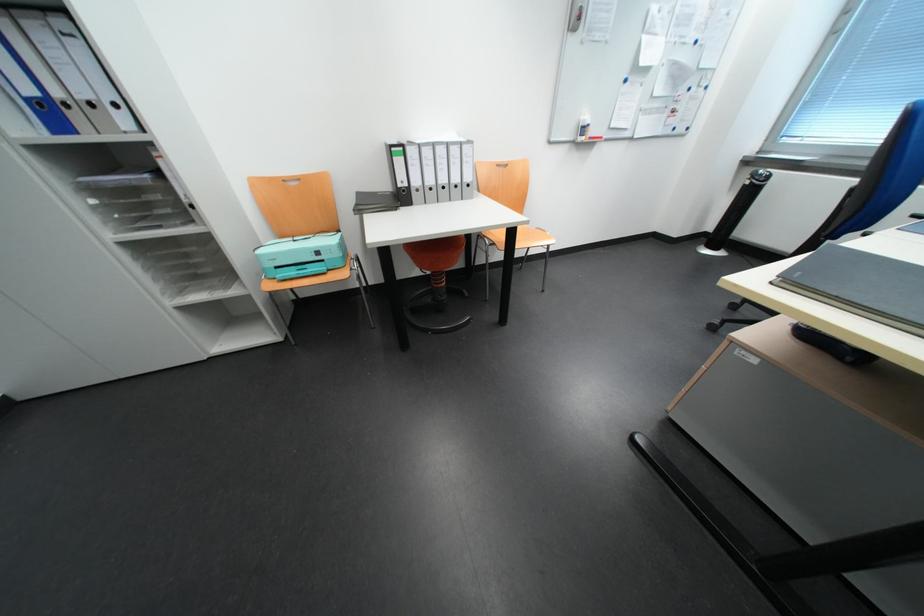
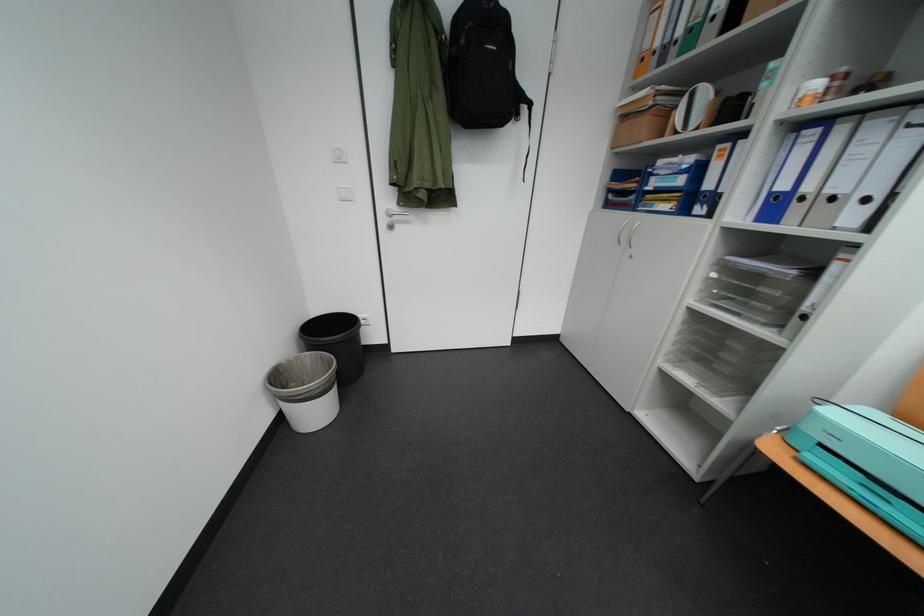
Where in the second image is the point corresponding to point 104,203 from the first image?

(724, 277)